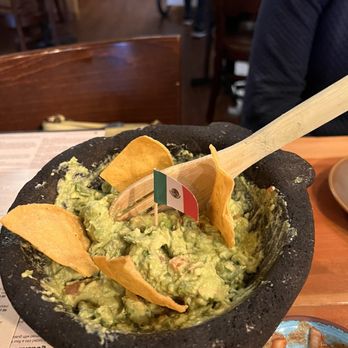
Image resolution: width=348 pixels, height=348 pixels. In order to click on wooden spoon in this screenshot , I will do `click(265, 148)`.